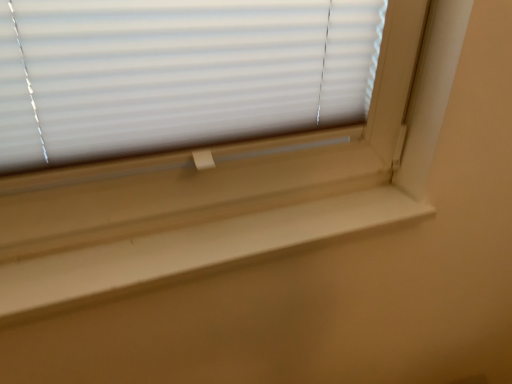
This screenshot has width=512, height=384. I want to click on blank space situated above white smooth window sill at center (from a real-world perspective), so click(232, 233).